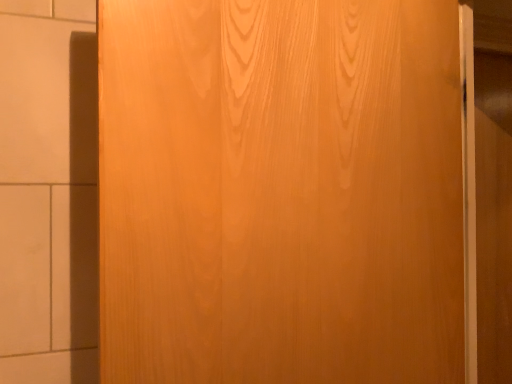
Locate an element on the screen. The image size is (512, 384). wooden door at center is located at coordinates (280, 192).

Describe the element at coordinates (280, 192) in the screenshot. I see `wooden door at center` at that location.

Find the location of `wooden barn door at right`. wooden barn door at right is located at coordinates (493, 187).

What do you see at coordinates (493, 187) in the screenshot? I see `wooden barn door at right` at bounding box center [493, 187].

You are a GUI agent. You are given a task and a screenshot of the screen. Output one action in this format:
    pyautogui.click(x=<x>, y=<y>)
    Task: Click on the wooden door at center
    Image resolution: width=512 pixels, height=384 pixels.
    Given the screenshot: What is the action you would take?
    click(280, 192)

In the image, is wooden door at center on the left side or the right side of wooden barn door at right?

From the image, it's evident that wooden door at center is to the left of wooden barn door at right.

Which is behind, wooden door at center or wooden barn door at right?

wooden barn door at right is behind.

Does point (118, 182) appear closer or farther from the camera than point (489, 376)?

Clearly, point (118, 182) is closer to the camera than point (489, 376).

From the image's perspective, is wooden door at center located above or below wooden barn door at right?

From the image's perspective, wooden door at center appears above wooden barn door at right.

From a real-world perspective, between wooden door at center and wooden barn door at right, who is vertically lower?

From a 3D spatial view, wooden barn door at right is below.

Between wooden door at center and wooden barn door at right, which one has larger width?

Wider between the two is wooden door at center.

Considering the sizes of objects wooden door at center and wooden barn door at right in the image provided, who is taller, wooden door at center or wooden barn door at right?

wooden barn door at right is taller.

Can you confirm if wooden door at center is bigger than wooden barn door at right?

Yes.

In the scene shown: Would you say wooden door at center is outside wooden barn door at right?

wooden door at center is positioned outside wooden barn door at right.

Looking at this image, is wooden door at center far from wooden barn door at right?

No, there isn't a large distance between wooden door at center and wooden barn door at right.

Is wooden door at center turned away from wooden barn door at right?

No, wooden barn door at right is not at the back of wooden door at center.

Can you tell me how much wooden door at center and wooden barn door at right differ in facing direction?

The angular difference between wooden door at center and wooden barn door at right is 9.38 degrees.

You are a GUI agent. You are given a task and a screenshot of the screen. Output one action in this format:
    pyautogui.click(x=<x>, y=<y>)
    Task: Click on the door that is above the wooden barn door at right (from a real-world perspective)
    This screenshot has height=384, width=512.
    Given the screenshot: What is the action you would take?
    pyautogui.click(x=280, y=192)

Between wooden barn door at right and wooden door at center, which one appears on the left side from the viewer's perspective?

Positioned to the left is wooden door at center.

Considering the positions of objects wooden barn door at right and wooden door at center in the image provided, who is in front, wooden barn door at right or wooden door at center?

wooden door at center is closer to the camera.

Considering the positions of points (483, 177) and (251, 45), is point (483, 177) farther from camera compared to point (251, 45)?

Yes.

From the image's perspective, which is below, wooden barn door at right or wooden door at center?

wooden barn door at right appears lower in the image.

From a real-world perspective, is wooden barn door at right positioned under wooden door at center based on gravity?

Yes, from a real-world perspective, wooden barn door at right is under wooden door at center.

Considering the sizes of objects wooden barn door at right and wooden door at center in the image provided, who is wider, wooden barn door at right or wooden door at center?

wooden door at center.

Which of these two, wooden barn door at right or wooden door at center, stands taller?

With more height is wooden barn door at right.

Considering the relative sizes of wooden barn door at right and wooden door at center in the image provided, is wooden barn door at right bigger than wooden door at center?

Actually, wooden barn door at right might be smaller than wooden door at center.

Can wooden door at center be found inside wooden barn door at right?

That's incorrect, wooden door at center is not inside wooden barn door at right.

Is wooden barn door at right far from wooden door at center?

No, wooden barn door at right is not far from wooden door at center.

In the scene shown: Is wooden barn door at right positioned with its back to wooden door at center?

wooden barn door at right does not have its back to wooden door at center.

Can you tell me how much wooden barn door at right and wooden door at center differ in facing direction?

The angular difference between wooden barn door at right and wooden door at center is 9.38 degrees.

How far apart are wooden barn door at right and wooden door at center?

A distance of 27.62 inches exists between wooden barn door at right and wooden door at center.

Find the location of a particular element. barn door located on the right of wooden door at center is located at coordinates (493, 187).

Locate an element on the screen. The height and width of the screenshot is (384, 512). door on the left of wooden barn door at right is located at coordinates (280, 192).

In the image, there is a wooden barn door at right. At what (x,y) coordinates should I click in order to perform the action: click on door above it (from the image's perspective). Please return your answer as a coordinate pair (x, y). The height and width of the screenshot is (384, 512). Looking at the image, I should click on (280, 192).